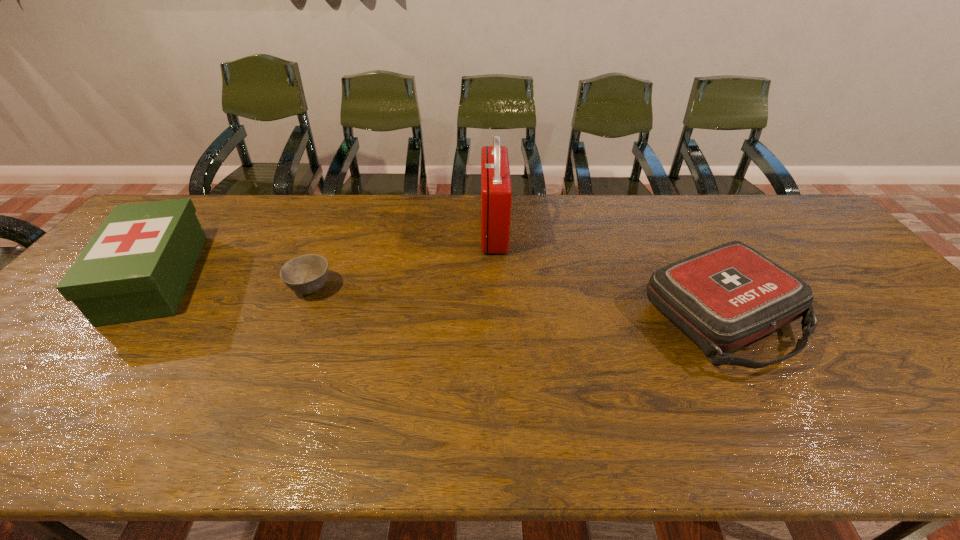
Identify the location of blank area located 0.080m on the front face of the tallest first-aid kit. The width and height of the screenshot is (960, 540). (456, 229).

I want to click on vacant space located on the back of the second tallest first-aid kit, so click(217, 204).

The image size is (960, 540). I want to click on free space located on the back of the second shortest object, so click(x=670, y=223).

Identify the location of blank space located 0.180m on the right of the bowl. (398, 288).

Identify the location of object at the far edge. The height and width of the screenshot is (540, 960). (496, 193).

Where is `object situated at the left edge`? Image resolution: width=960 pixels, height=540 pixels. object situated at the left edge is located at coordinates (137, 265).

Locate an element on the screen. Image resolution: width=960 pixels, height=540 pixels. blank space at the far edge is located at coordinates (565, 215).

I want to click on vacant space at the near edge of the desktop, so click(x=619, y=427).

Find the location of `free space at the left edge of the desktop`. free space at the left edge of the desktop is located at coordinates (12, 382).

Find the location of `blank region between the shortest first-aid kit and the shortest object`. blank region between the shortest first-aid kit and the shortest object is located at coordinates (516, 302).